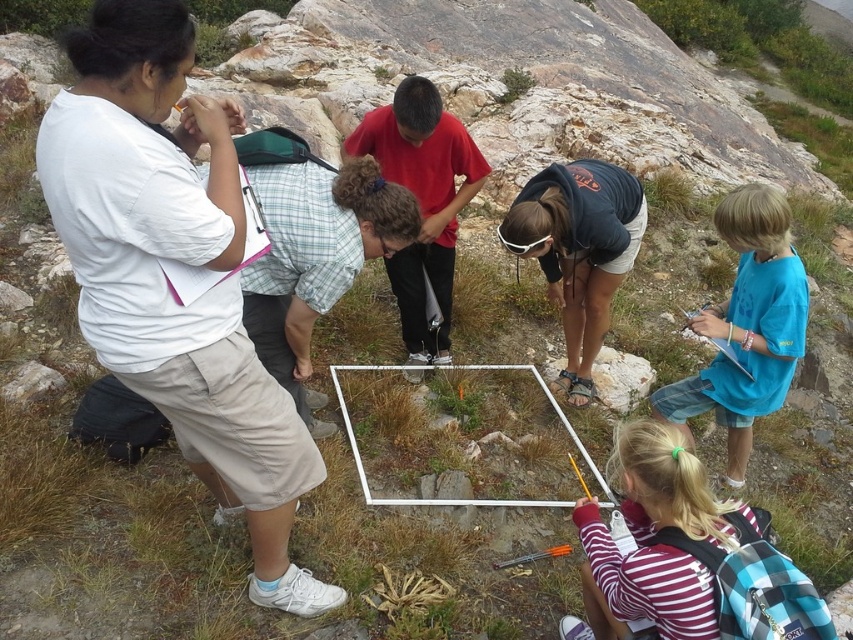
In the scene shown: You are a participant in this outdoor educational activity. You notice two objects at the center of your view. One is the black fabric shirt at center and the other is the gray rock at center. Which object is larger in size?

The black fabric shirt at center is bigger than the gray rock at center according to the description.

Based on the photo, you are part of the group observing the plants in the rocky terrain. You notice two points marked on the ground at coordinates point (137,184) and point (602,358). If you were to walk from the first point to the second point, would you be moving towards the group or away from them?

Point (137,184) is in front of point (602,358). Since you are starting at the first point and moving to the second, you would be moving away from the group because the second point is behind the first relative to their position.